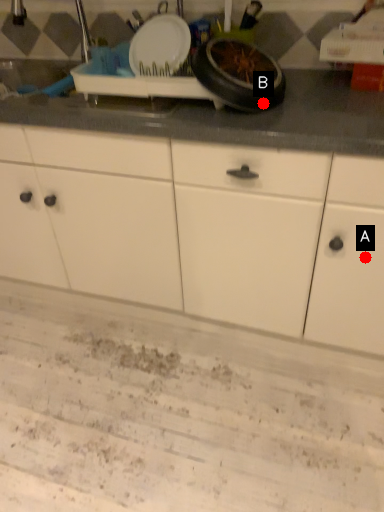
Question: Two points are circled on the image, labeled by A and B beside each circle. Which of the following is the farthest from the observer?

Choices:
 (A) A is further
 (B) B is further

Answer: (A)